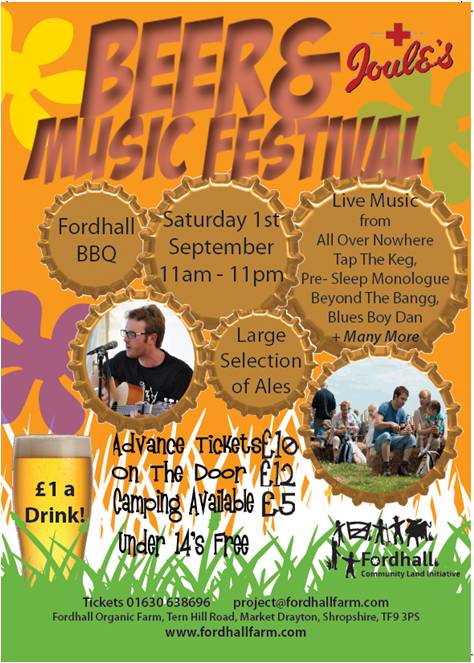
Locate an element on the screen. white backdrop is located at coordinates (174, 339).